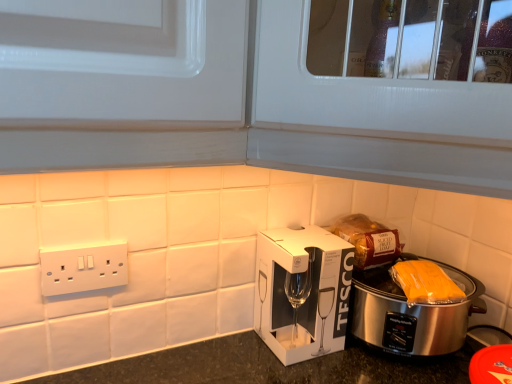
Measure the distance between point (296, 101) and camera.

Point (296, 101) and camera are 19.45 inches apart.

Where is `white plastic power plugs and sockets at lower left`? The width and height of the screenshot is (512, 384). white plastic power plugs and sockets at lower left is located at coordinates (83, 267).

What is the approximate width of white cardboard box at center?

white cardboard box at center is 6.13 inches in width.

What is the approximate width of silver metallic slow cooker at lower right?

It is 11.41 inches.

Find the location of a particular element. white textured cabinet at upper center is located at coordinates (372, 118).

Looking at this image, which of these two, white plastic power plugs and sockets at lower left or white textured cabinet at upper center, is wider?

white textured cabinet at upper center is wider.

Can you confirm if white plastic power plugs and sockets at lower left is shorter than white textured cabinet at upper center?

Yes.

Looking at this image, could white textured cabinet at upper center be considered to be inside white plastic power plugs and sockets at lower left?

No, white textured cabinet at upper center is not inside white plastic power plugs and sockets at lower left.

From a real-world perspective, is white textured cabinet at upper center located higher than white plastic power plugs and sockets at lower left?

Yes, from a real-world perspective, white textured cabinet at upper center is on top of white plastic power plugs and sockets at lower left.

Is white plastic power plugs and sockets at lower left completely or partially inside white textured cabinet at upper center?

No, white plastic power plugs and sockets at lower left is not surrounded by white textured cabinet at upper center.

Which of these two, white textured cabinet at upper center or white plastic power plugs and sockets at lower left, is thinner?

With smaller width is white plastic power plugs and sockets at lower left.

How different are the orientations of white textured cabinet at upper center and white plastic power plugs and sockets at lower left in degrees?

The facing directions of white textured cabinet at upper center and white plastic power plugs and sockets at lower left are 43.4 degrees apart.

What are the coordinates of `power plugs and sockets located above the silver metallic slow cooker at lower right (from the image's perspective)` in the screenshot? It's located at (83, 267).

Which object is further away from the camera taking this photo, white plastic power plugs and sockets at lower left or silver metallic slow cooker at lower right?

Positioned behind is silver metallic slow cooker at lower right.

How many degrees apart are the facing directions of white plastic power plugs and sockets at lower left and silver metallic slow cooker at lower right?

The angular difference between white plastic power plugs and sockets at lower left and silver metallic slow cooker at lower right is 1.42 degrees.

Would you say white plastic power plugs and sockets at lower left contains silver metallic slow cooker at lower right?

Definitely not — silver metallic slow cooker at lower right is not inside white plastic power plugs and sockets at lower left.

Is point (396, 273) closer to camera compared to point (114, 263)?

No, it is not.

In the image, is yellow plastic bag at right positioned in front of or behind white plastic power plugs and sockets at lower left?

Clearly, yellow plastic bag at right is behind white plastic power plugs and sockets at lower left.

Where is `food on the right of the white plastic power plugs and sockets at lower left`? food on the right of the white plastic power plugs and sockets at lower left is located at coordinates (425, 283).

Is yellow plastic bag at right not within silver metallic slow cooker at lower right?

Yes.

Where is `slow cooker located underneath the yellow plastic bag at right (from a real-world perspective)`? The image size is (512, 384). slow cooker located underneath the yellow plastic bag at right (from a real-world perspective) is located at coordinates (411, 313).

Does yellow plastic bag at right have a greater height compared to silver metallic slow cooker at lower right?

No.

In the scene shown: Is yellow plastic bag at right next to silver metallic slow cooker at lower right and touching it?

Yes.

Is point (93, 263) farther from viewer compared to point (296, 261)?

No, it is in front of (296, 261).

Are white plastic power plugs and sockets at lower left and white cardboard box at center beside each other?

No, white plastic power plugs and sockets at lower left is not beside white cardboard box at center.

From the picture: Is white plastic power plugs and sockets at lower left looking in the opposite direction of white cardboard box at center?

No, white plastic power plugs and sockets at lower left is not facing away from white cardboard box at center.

Based on the photo, who is smaller, white plastic power plugs and sockets at lower left or white cardboard box at center?

white plastic power plugs and sockets at lower left.

Is white cardboard box at center bigger or smaller than white plastic power plugs and sockets at lower left?

white cardboard box at center is bigger than white plastic power plugs and sockets at lower left.

In terms of width, does white cardboard box at center look wider or thinner when compared to white plastic power plugs and sockets at lower left?

Considering their sizes, white cardboard box at center looks broader than white plastic power plugs and sockets at lower left.

Based on the photo, can you confirm if white cardboard box at center is positioned to the left of white plastic power plugs and sockets at lower left?

No, white cardboard box at center is not to the left of white plastic power plugs and sockets at lower left.

In the image, is white cardboard box at center positioned in front of or behind white plastic power plugs and sockets at lower left?

white cardboard box at center is positioned farther from the viewer than white plastic power plugs and sockets at lower left.

Find the location of `power plugs and sockets to the left of white textured cabinet at upper center`. power plugs and sockets to the left of white textured cabinet at upper center is located at coordinates (83, 267).

This screenshot has width=512, height=384. Find the location of `glass door in front of the white plastic power plugs and sockets at lower left`. glass door in front of the white plastic power plugs and sockets at lower left is located at coordinates (372, 118).

Looking at this image, when comparing their distances from silver metallic slow cooker at lower right, does white cardboard box at center or white plastic power plugs and sockets at lower left seem further?

Based on the image, white plastic power plugs and sockets at lower left appears to be further to silver metallic slow cooker at lower right.

Estimate the real-world distances between objects in this image. Which object is further from white cardboard box at center, white textured cabinet at upper center or silver metallic slow cooker at lower right?

white textured cabinet at upper center is further to white cardboard box at center.

Looking at the image, which one is located closer to white plastic power plugs and sockets at lower left, white cardboard box at center or yellow plastic bag at right?

white cardboard box at center lies closer to white plastic power plugs and sockets at lower left than the other object.

From the image, which object appears to be farther from silver metallic slow cooker at lower right, white plastic power plugs and sockets at lower left or white textured cabinet at upper center?

Based on the image, white plastic power plugs and sockets at lower left appears to be further to silver metallic slow cooker at lower right.

From the image, which object appears to be farther from silver metallic slow cooker at lower right, yellow plastic bag at right or white textured cabinet at upper center?

white textured cabinet at upper center is positioned further to the anchor silver metallic slow cooker at lower right.

Considering their positions, is yellow plastic bag at right positioned closer to white cardboard box at center than white plastic power plugs and sockets at lower left?

yellow plastic bag at right lies closer to white cardboard box at center than the other object.

Based on their spatial positions, is white plastic power plugs and sockets at lower left or white cardboard box at center closer to white textured cabinet at upper center?

white cardboard box at center is positioned closer to the anchor white textured cabinet at upper center.

Based on their spatial positions, is white textured cabinet at upper center or white plastic power plugs and sockets at lower left closer to silver metallic slow cooker at lower right?

white textured cabinet at upper center.

Image resolution: width=512 pixels, height=384 pixels. I want to click on slow cooker between white textured cabinet at upper center and white cardboard box at center in the front-back direction, so click(x=411, y=313).

This screenshot has width=512, height=384. What are the coordinates of `glass door located between white plastic power plugs and sockets at lower left and yellow plastic bag at right in the left-right direction` in the screenshot? It's located at (372, 118).

Where is `slow cooker between white plastic power plugs and sockets at lower left and yellow plastic bag at right from left to right`? slow cooker between white plastic power plugs and sockets at lower left and yellow plastic bag at right from left to right is located at coordinates (411, 313).

I want to click on food between white textured cabinet at upper center and white cardboard box at center in the front-back direction, so click(425, 283).